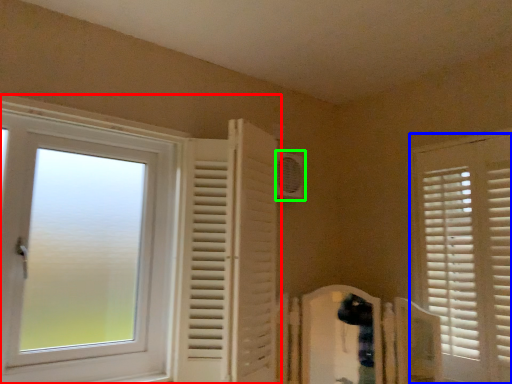
Question: Which object is the closest to the window (highlighted by a red box)? Choose among these: window (highlighted by a blue box) or air conditioning (highlighted by a green box).

Choices:
 (A) window
 (B) air conditioning

Answer: (B)